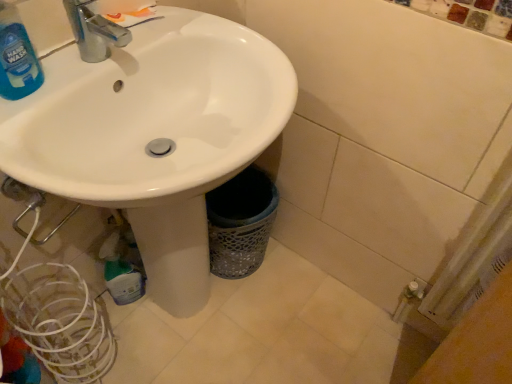
What do you see at coordinates (17, 57) in the screenshot?
I see `blue translucent liquid at upper left` at bounding box center [17, 57].

Where is `blue translucent liquid at upper left`? blue translucent liquid at upper left is located at coordinates (17, 57).

This screenshot has height=384, width=512. What do you see at coordinates (154, 135) in the screenshot? I see `white glossy sink at center` at bounding box center [154, 135].

Locate an element on the screen. This screenshot has width=512, height=384. white glossy sink at center is located at coordinates (154, 135).

You are a GUI agent. You are given a task and a screenshot of the screen. Output one action in this format:
    pyautogui.click(x=<x>, y=<y>)
    Task: Click on the blue translucent liquid at upper left
    
    Given the screenshot: What is the action you would take?
    pyautogui.click(x=17, y=57)

Which object is positioned more to the left, blue translucent liquid at upper left or white glossy sink at center?

blue translucent liquid at upper left.

Is the position of blue translucent liquid at upper left less distant than that of white glossy sink at center?

No, it is behind white glossy sink at center.

Between point (12, 55) and point (105, 142), which one is positioned behind?

Positioned behind is point (105, 142).

From the image's perspective, which one is positioned higher, blue translucent liquid at upper left or white glossy sink at center?

blue translucent liquid at upper left is shown above in the image.

Consider the image. From a real-world perspective, is blue translucent liquid at upper left on white glossy sink at center?

Indeed, from a real-world perspective, blue translucent liquid at upper left stands above white glossy sink at center.

Considering the relative sizes of blue translucent liquid at upper left and white glossy sink at center in the image provided, is blue translucent liquid at upper left thinner than white glossy sink at center?

Yes, blue translucent liquid at upper left is thinner than white glossy sink at center.

Which of these two, blue translucent liquid at upper left or white glossy sink at center, stands taller?

With more height is white glossy sink at center.

Considering the relative sizes of blue translucent liquid at upper left and white glossy sink at center in the image provided, is blue translucent liquid at upper left bigger than white glossy sink at center?

Actually, blue translucent liquid at upper left might be smaller than white glossy sink at center.

Can white glossy sink at center be found inside blue translucent liquid at upper left?

No, white glossy sink at center is located outside of blue translucent liquid at upper left.

Is blue translucent liquid at upper left with white glossy sink at center?

No, blue translucent liquid at upper left is not making contact with white glossy sink at center.

Is white glossy sink at center at the back of blue translucent liquid at upper left?

Correct, blue translucent liquid at upper left is looking away from white glossy sink at center.

How many degrees apart are the facing directions of blue translucent liquid at upper left and white glossy sink at center?

blue translucent liquid at upper left and white glossy sink at center are facing 4.24 degrees away from each other.

How far apart are blue translucent liquid at upper left and white glossy sink at center?

The distance of blue translucent liquid at upper left from white glossy sink at center is 12.04 inches.

I want to click on sink below the blue translucent liquid at upper left (from the image's perspective), so (x=154, y=135).

Which is more to the left, white glossy sink at center or blue translucent liquid at upper left?

From the viewer's perspective, blue translucent liquid at upper left appears more on the left side.

Is white glossy sink at center positioned before blue translucent liquid at upper left?

That is True.

Considering the points (187, 262) and (17, 64), which point is behind, point (187, 262) or point (17, 64)?

The point (187, 262) is farther from the camera.

Looking at this image, from the image's perspective, is white glossy sink at center above blue translucent liquid at upper left?

No, from the image's perspective, white glossy sink at center is not above blue translucent liquid at upper left.

From a real-world perspective, does white glossy sink at center stand above blue translucent liquid at upper left?

No, from a real-world perspective, white glossy sink at center is not on top of blue translucent liquid at upper left.

Is white glossy sink at center thinner than blue translucent liquid at upper left?

No.

Can you confirm if white glossy sink at center is taller than blue translucent liquid at upper left?

Correct, white glossy sink at center is much taller as blue translucent liquid at upper left.

Considering the sizes of white glossy sink at center and blue translucent liquid at upper left in the image, is white glossy sink at center bigger or smaller than blue translucent liquid at upper left?

Considering their sizes, white glossy sink at center takes up more space than blue translucent liquid at upper left.

Would you say white glossy sink at center contains blue translucent liquid at upper left?

Yes, white glossy sink at center contains blue translucent liquid at upper left.

Is white glossy sink at center in contact with blue translucent liquid at upper left?

No, white glossy sink at center is not touching blue translucent liquid at upper left.

Is white glossy sink at center facing towards blue translucent liquid at upper left?

→ No, white glossy sink at center is not aimed at blue translucent liquid at upper left.

Where is `cleaning product behind the white glossy sink at center`? cleaning product behind the white glossy sink at center is located at coordinates (17, 57).

This screenshot has width=512, height=384. I want to click on cleaning product above the white glossy sink at center (from the image's perspective), so click(17, 57).

Find the location of a particular element. The height and width of the screenshot is (384, 512). cleaning product on the left of white glossy sink at center is located at coordinates (17, 57).